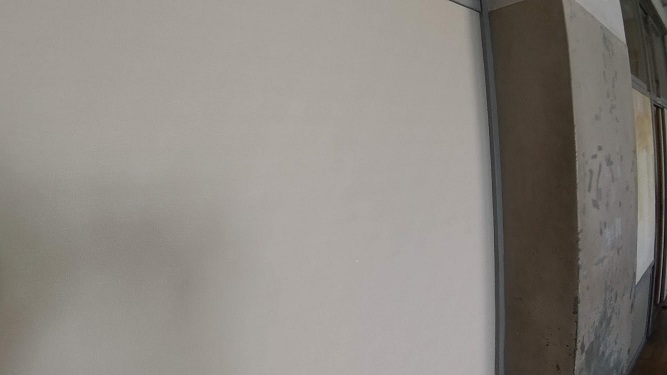
Locate an element on the screen. This screenshot has height=375, width=667. damaged wall is located at coordinates (619, 150), (542, 153).